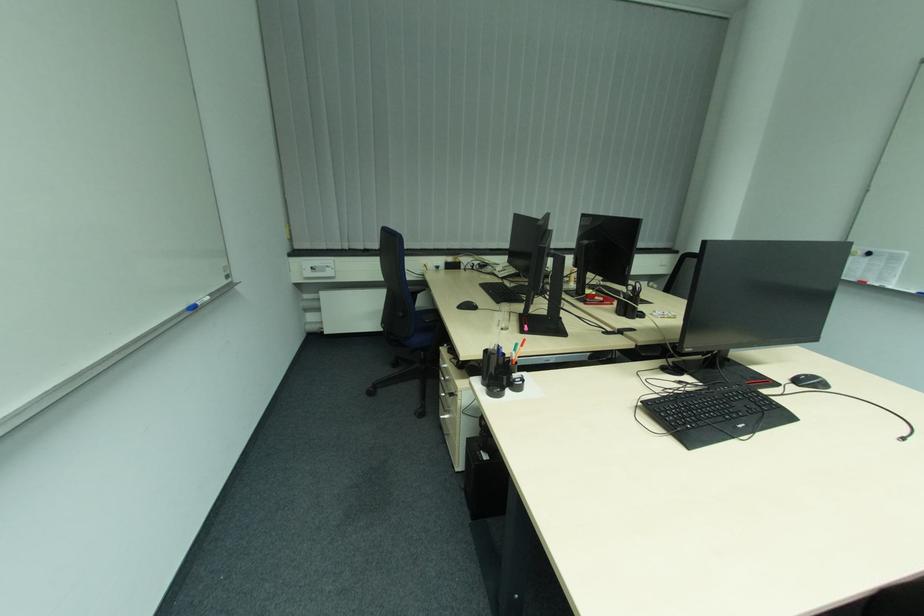
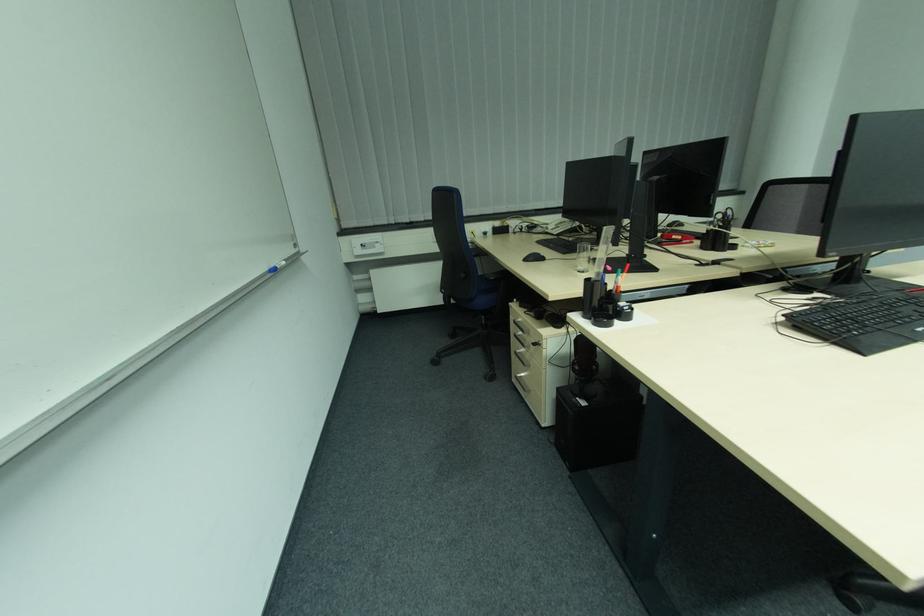
Question: The camera is either moving clockwise (left) or counter-clockwise (right) around the object. The first image is from the beginning of the video and the second image is from the end. Is the camera moving left or right when shooting the video?

Choices:
 (A) Left
 (B) Right

Answer: (B)